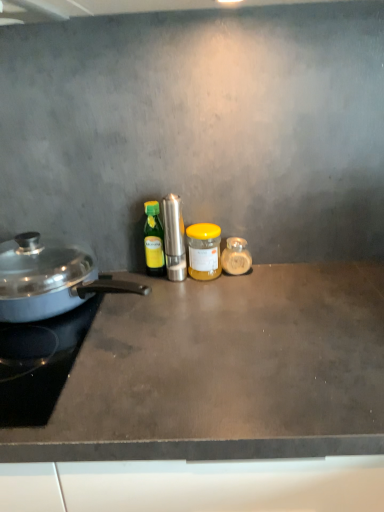
Find the location of a particular element. unoccupied region to the right of yellow matte jar at center, arranged as the 2th kitchen appliance when viewed from the right is located at coordinates (275, 280).